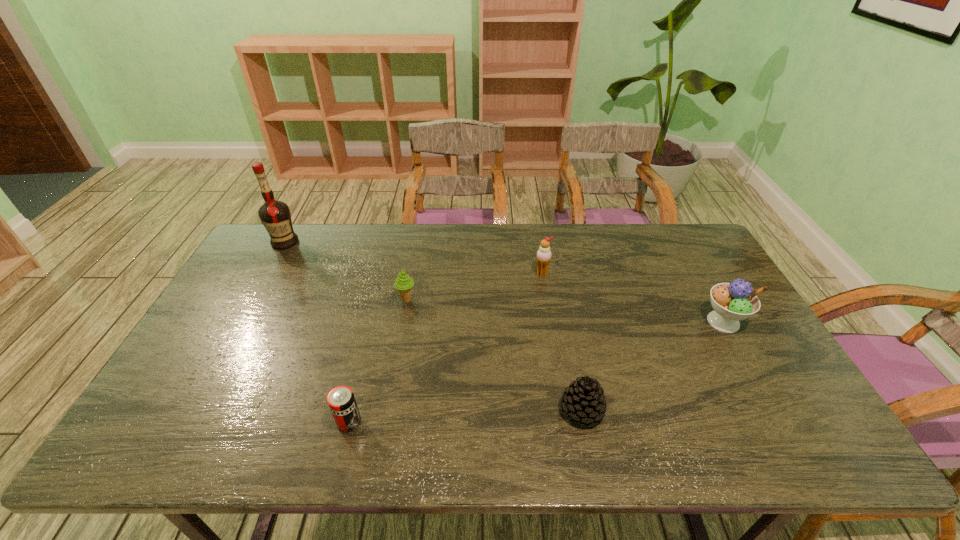
Where is `object at the left edge`? The image size is (960, 540). object at the left edge is located at coordinates (275, 215).

The image size is (960, 540). In order to click on object that is at the right edge in this screenshot , I will do `click(732, 302)`.

Where is `object that is at the far left corner`? The height and width of the screenshot is (540, 960). object that is at the far left corner is located at coordinates point(275,215).

Image resolution: width=960 pixels, height=540 pixels. What are the coordinates of `vacant position at the far edge of the desktop` in the screenshot? It's located at (462, 231).

The height and width of the screenshot is (540, 960). In the image, there is a desktop. Identify the location of vacant space at the near edge. (536, 444).

In the image, there is a desktop. At what (x,y) coordinates should I click in order to perform the action: click on vacant space at the left edge. Please return your answer as a coordinate pair (x, y). This screenshot has height=540, width=960. Looking at the image, I should click on (171, 410).

The width and height of the screenshot is (960, 540). I want to click on vacant space at the right edge of the desktop, so click(790, 389).

In the image, there is a desktop. Identify the location of free space at the near right corner. Image resolution: width=960 pixels, height=540 pixels. (786, 434).

The height and width of the screenshot is (540, 960). In order to click on unoccupied position between the can and the third object from left to right in this screenshot , I will do tap(378, 361).

Find the location of a particular element. The width and height of the screenshot is (960, 540). empty location between the farthest object and the can is located at coordinates (317, 332).